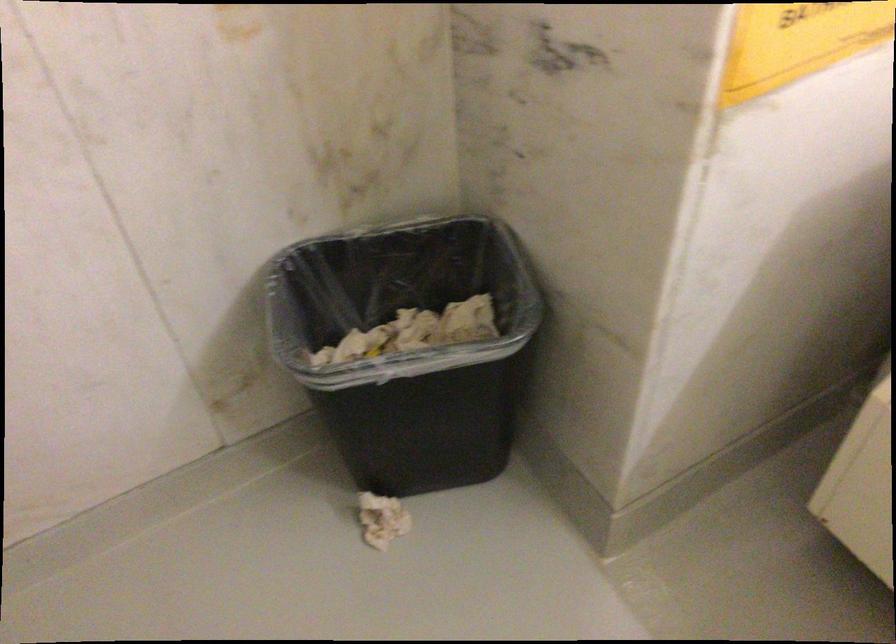
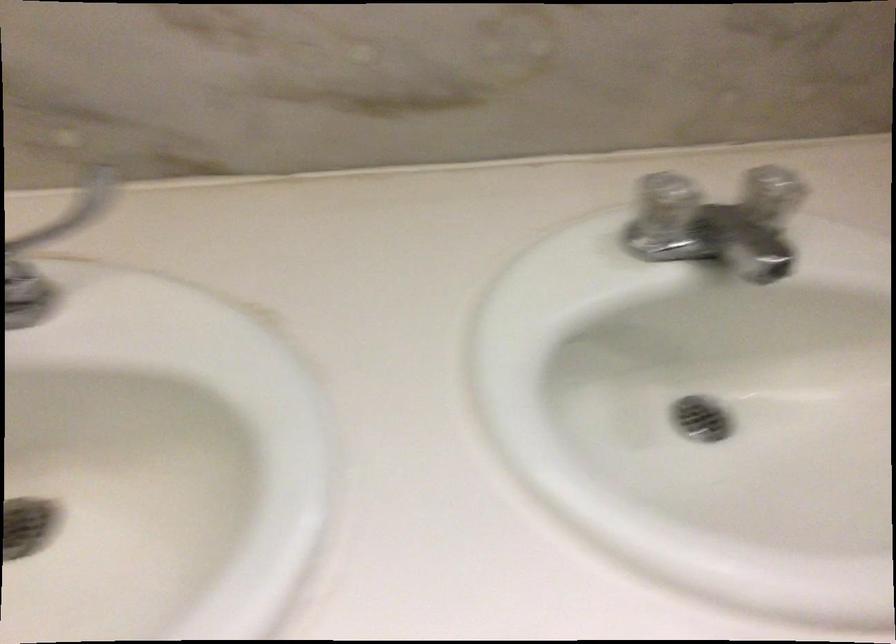
The first image is from the beginning of the video and the second image is from the end. How did the camera likely rotate when shooting the video?

The camera rotated toward right-down.